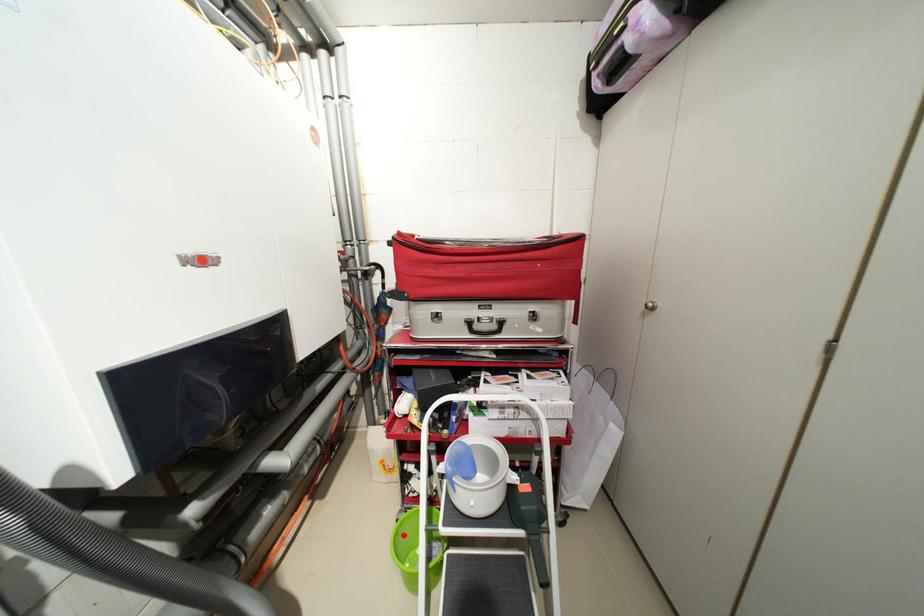
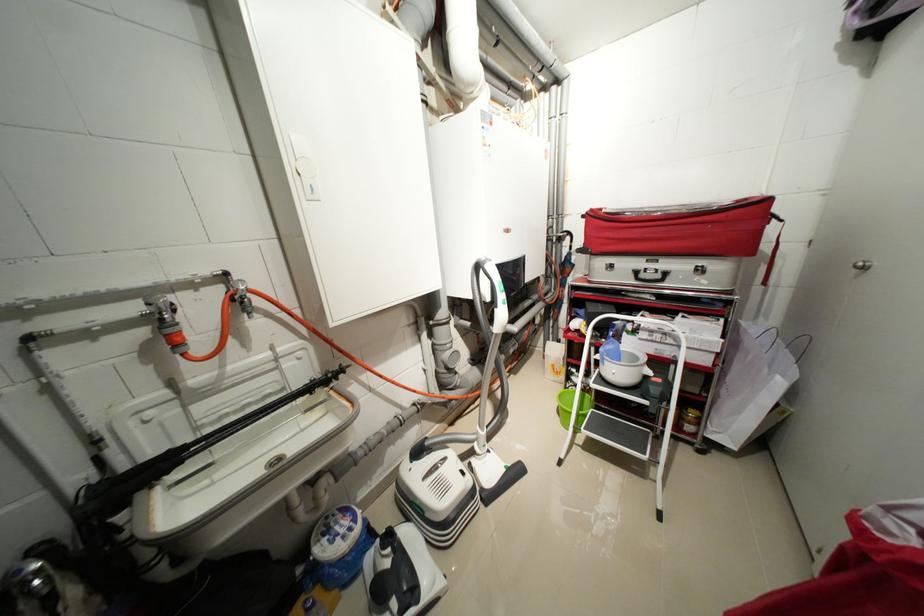
Find the pixel in the second image that matches the highlighted location in the first image.

(566, 397)